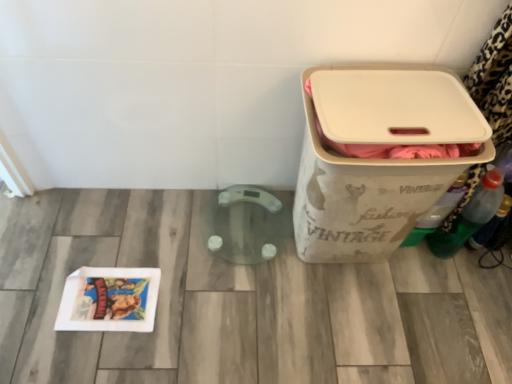
Question: From the image's perspective, relative to beige fabric storage bin at right, is translucent plastic bottle at right, marked as the 3th bottle in a left-to-right arrangement, above or below?

Choices:
 (A) above
 (B) below

Answer: (B)

Question: Looking at their shapes, would you say translucent plastic bottle at right, marked as the 3th bottle in a left-to-right arrangement, is wider or thinner than beige fabric storage bin at right?

Choices:
 (A) thin
 (B) wide

Answer: (A)

Question: Considering the real-world distances, which object is closest to the beige fabric storage bin at right?

Choices:
 (A) green plastic bottle at right, which is the first bottle from left to right
 (B) translucent plastic bottle at right, marked as the 3th bottle in a left-to-right arrangement
 (C) green plastic bottle at right, the 2th bottle viewed from the left

Answer: (A)

Question: Considering the real-world distances, which object is closest to the translucent plastic bottle at right, the first bottle when ordered from right to left?

Choices:
 (A) green plastic bottle at right, arranged as the second bottle when viewed from the right
 (B) green plastic bottle at right, arranged as the third bottle when viewed from the right
 (C) beige fabric storage bin at right

Answer: (A)